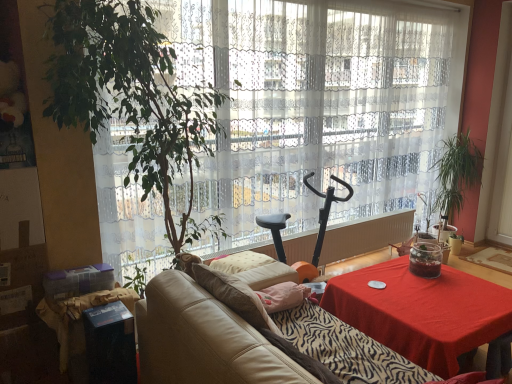
Find the location of `free spot in front of translucent glass jar at center`. free spot in front of translucent glass jar at center is located at coordinates (435, 285).